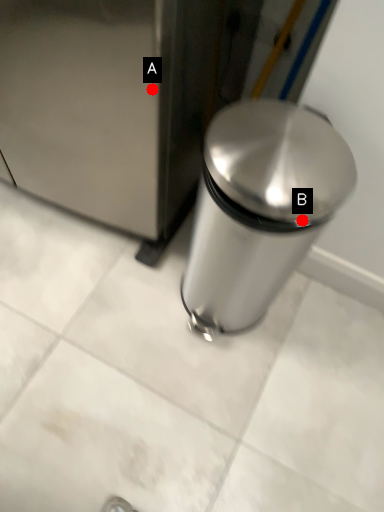
Question: Two points are circled on the image, labeled by A and B beside each circle. Which point appears farthest from the camera in this image?

Choices:
 (A) A is further
 (B) B is further

Answer: (A)